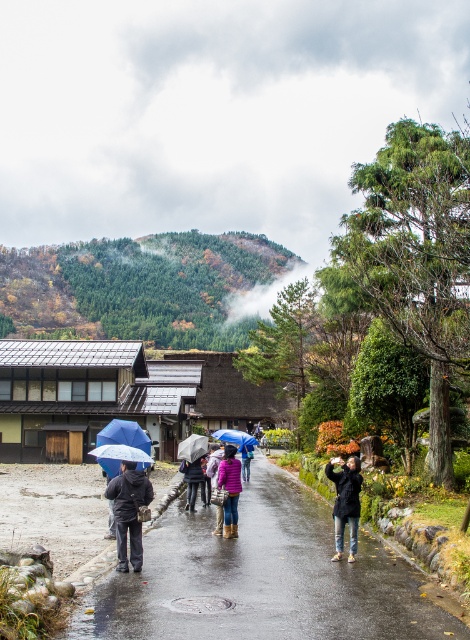
Question: Can you confirm if transparent plastic umbrella at center is wider than purple matte jacket at center?

Choices:
 (A) no
 (B) yes

Answer: (B)

Question: Does dark gray matte jacket at center have a lesser width compared to dark brown fur coat at lower right?

Choices:
 (A) yes
 (B) no

Answer: (A)

Question: Which point is farther to the camera?

Choices:
 (A) (234, 525)
 (B) (124, 492)
 (C) (341, 554)
 (D) (247, 460)

Answer: (D)

Question: Is dark brown fur coat at lower right below purple matte jacket at center?

Choices:
 (A) no
 (B) yes

Answer: (A)

Question: Which object is the farthest from the dark blue jacket at center?

Choices:
 (A) transparent plastic umbrella at center
 (B) transparent plastic umbrella at lower left
 (C) blue matte umbrella at center

Answer: (C)

Question: Estimate the real-world distances between objects in this image. Which object is farther from the dark blue jacket at center?

Choices:
 (A) blue matte umbrella at center
 (B) transparent plastic umbrella at lower left
 (C) dark gray matte jacket at center
 (D) pink matte jacket at center

Answer: (A)